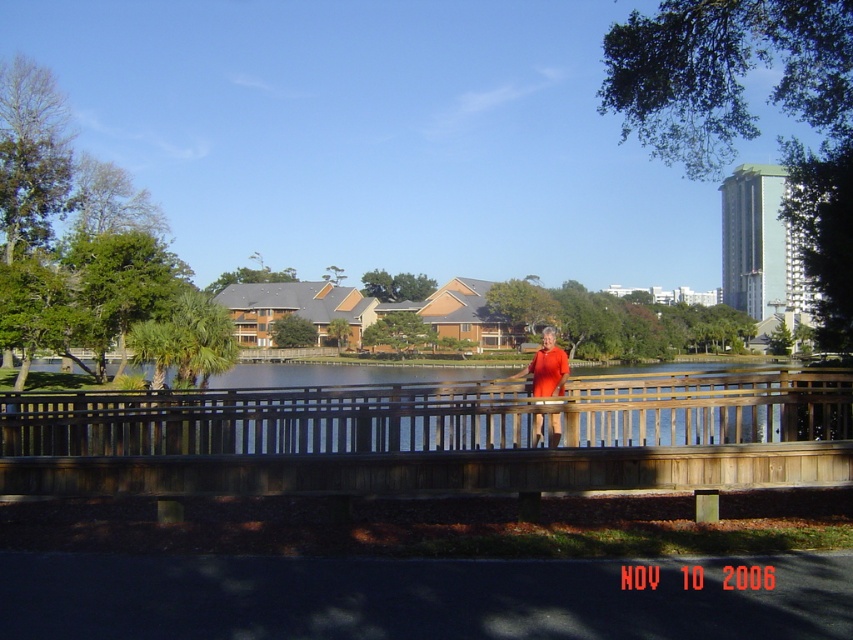
What do you see at coordinates (432, 436) in the screenshot? The height and width of the screenshot is (640, 853). I see `brown wooden bridge at center` at bounding box center [432, 436].

From the picture: Does brown wooden bridge at center have a greater height compared to orange matte dress at center?

No.

Image resolution: width=853 pixels, height=640 pixels. What do you see at coordinates (432, 436) in the screenshot?
I see `brown wooden bridge at center` at bounding box center [432, 436].

Where is `brown wooden bridge at center`? The width and height of the screenshot is (853, 640). brown wooden bridge at center is located at coordinates (432, 436).